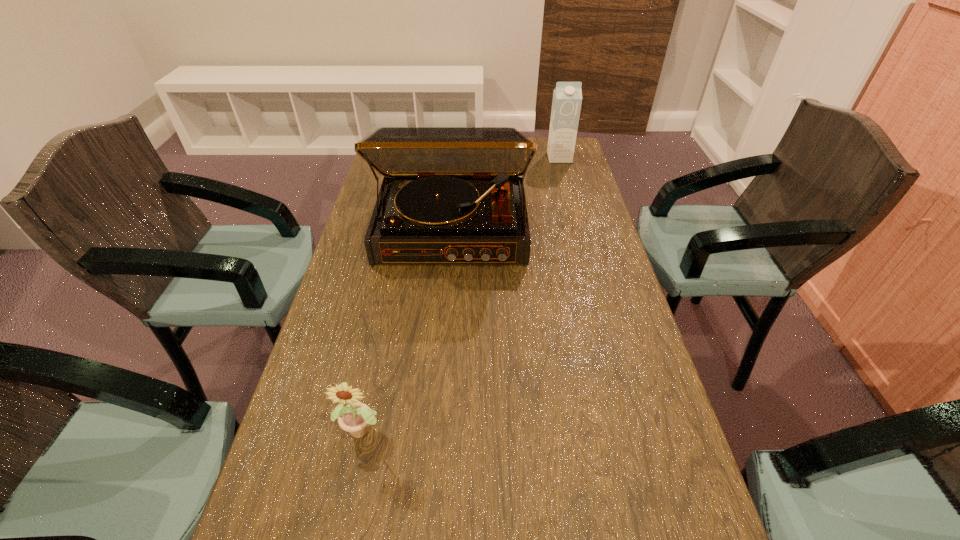
Image resolution: width=960 pixels, height=540 pixels. I want to click on record player present at the left edge, so click(450, 195).

Locate an element on the screen. This screenshot has height=540, width=960. sunflower located in the left edge section of the desktop is located at coordinates (354, 418).

At what (x,y) coordinates should I click in order to perform the action: click on object that is positioned at the right edge. Please return your answer as a coordinate pair (x, y). The height and width of the screenshot is (540, 960). Looking at the image, I should click on (567, 96).

Locate an element on the screen. The width and height of the screenshot is (960, 540). object that is at the far right corner is located at coordinates coord(567,96).

Find the location of a particular element. The height and width of the screenshot is (540, 960). vacant area at the right edge is located at coordinates (582, 274).

In the image, there is a desktop. At what (x,y) coordinates should I click in order to perform the action: click on vacant space at the far right corner. Please return your answer as a coordinate pair (x, y). Looking at the image, I should click on (539, 158).

Locate an element on the screen. free point between the tallest object and the nearest object is located at coordinates (408, 329).

At what (x,y) coordinates should I click in order to perform the action: click on object that ranks as the second closest to the shortest object. Please return your answer as a coordinate pair (x, y). This screenshot has height=540, width=960. Looking at the image, I should click on (567, 96).

Select which object appears as the second closest to the rightmost object. Please provide its 2D coordinates. Your answer should be formatted as a tuple, i.e. [(x, y)], where the tuple contains the x and y coordinates of a point satisfying the conditions above.

[(354, 418)]